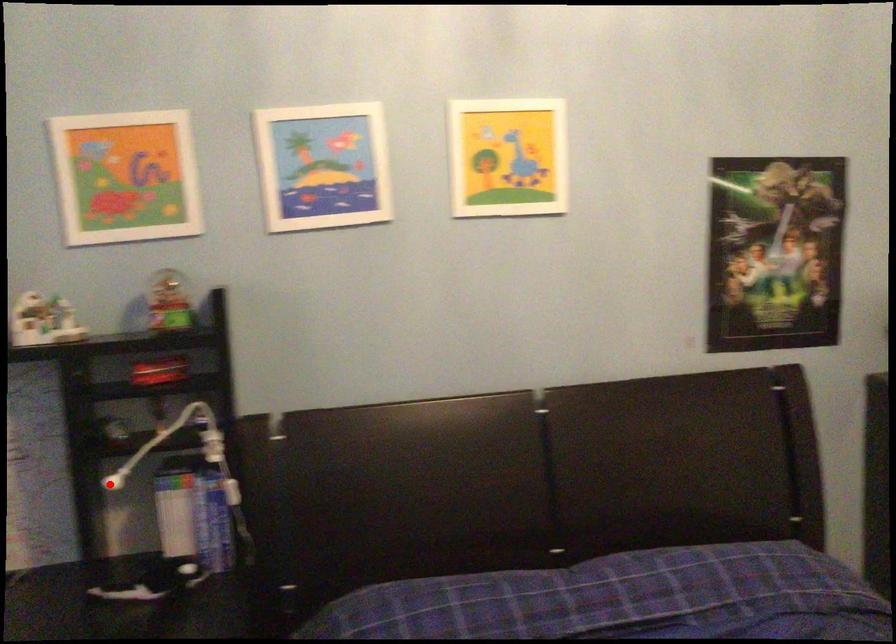
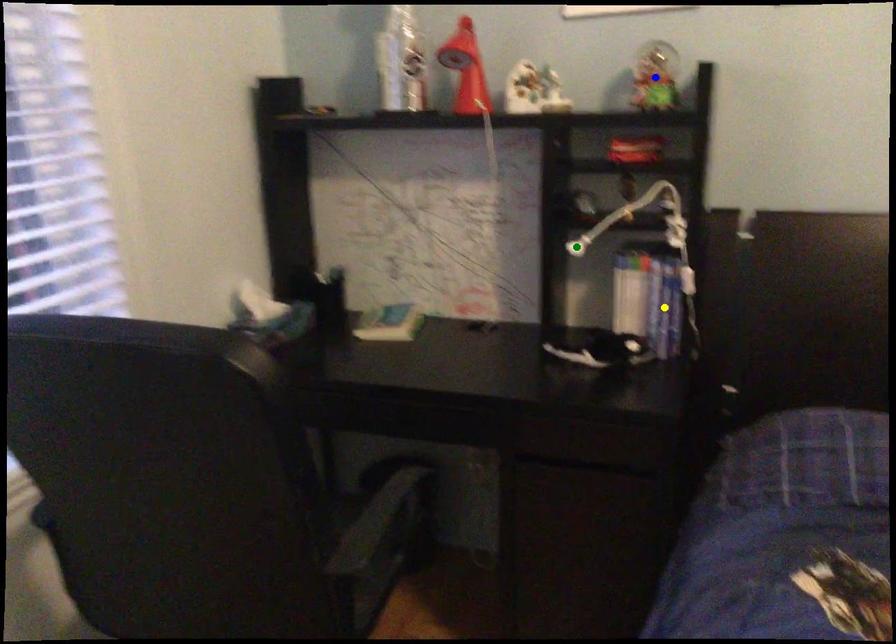
Question: I am providing you with two images of the same scene from different viewpoints. A red point is marked on the first image. You are given multiple points on the second image. Which mark in image 2 goes with the point in image 1?

Choices:
 (A) yellow point
 (B) blue point
 (C) green point

Answer: (C)